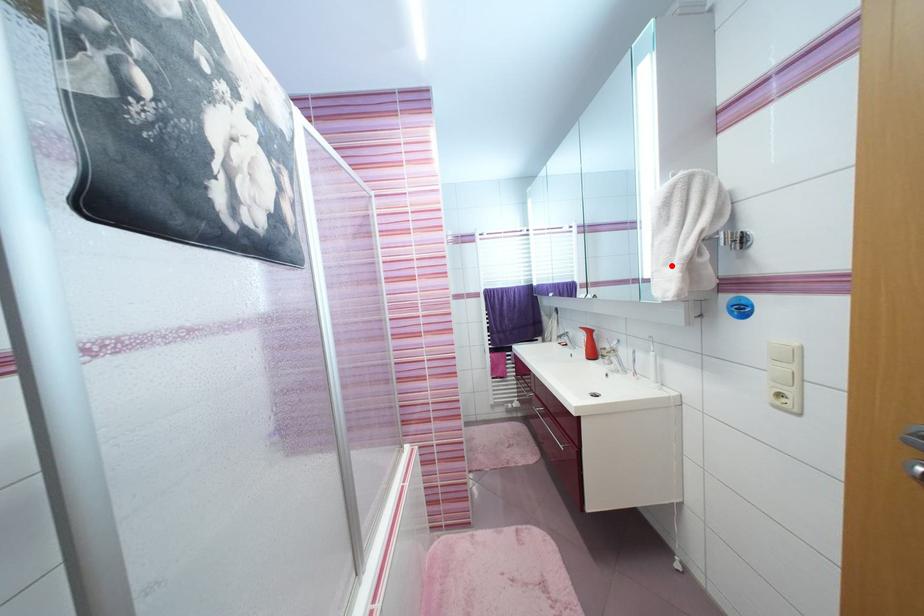
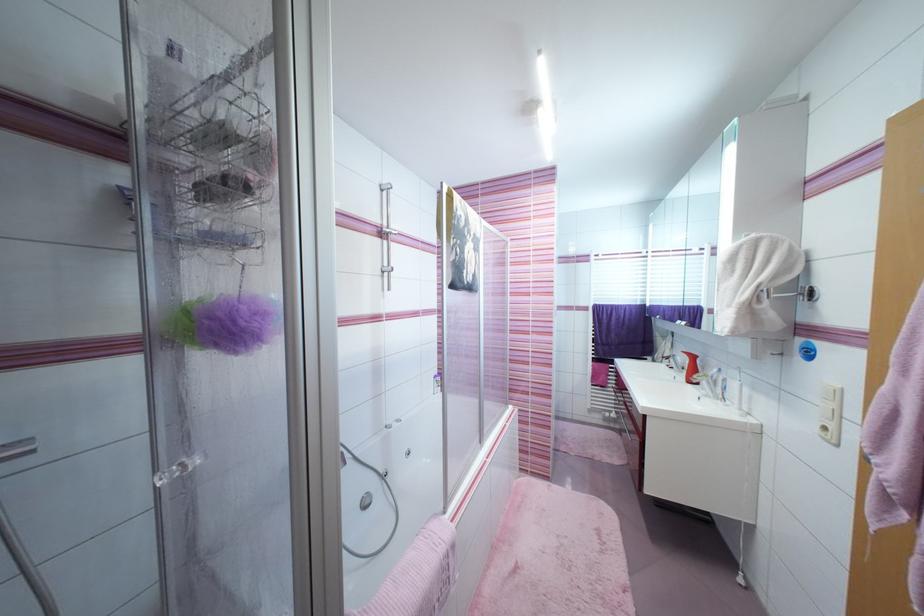
Locate, in the second image, the point that corresponds to the highlighted location in the first image.

(735, 307)